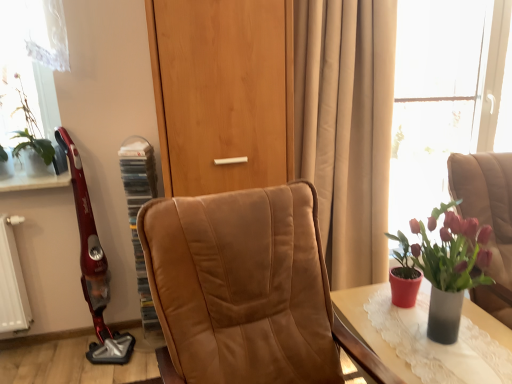
What are the coordinates of `vacant location below purple matte vase at right, marked as the first houseplant in a right-to-left arrangement (from a real-world perspective)` in the screenshot? It's located at (443, 342).